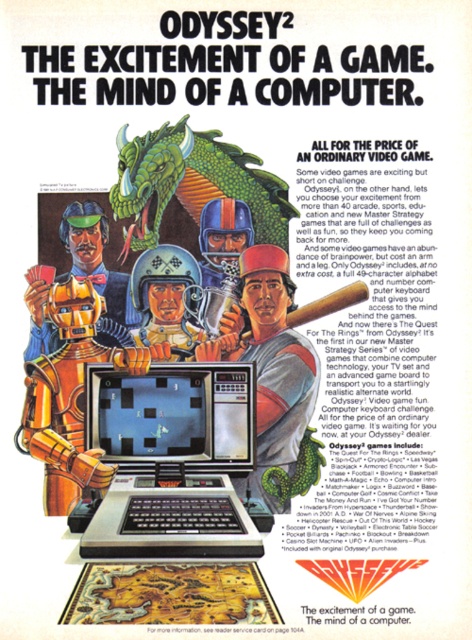
In the vintage Odyssey2 advertisement, you see a silver metallic laptop at center and a green matte dragon at upper center. Which object is positioned higher on the image?

The green matte dragon at upper center is positioned higher than the silver metallic laptop at center.

Looking at the vintage Odyssey2 advertisement, you see a silver metallic laptop at center and a green matte dragon at upper center. Which object is positioned to the right?

The green matte dragon at upper center is positioned to the right of the silver metallic laptop at center.

You are looking at the vintage Odyssey2 advertisement. There are two points marked in the image. The first point is at coordinates point (220, 540) and the second point is at point (148, 212). Which point is closer to you?

Point (220, 540) is closer to the viewer than point (148, 212).